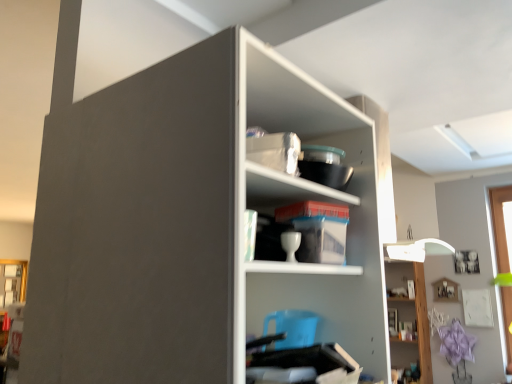
Question: In which direction should I rotate to look at white glossy cup at center, which is counted as the 2th shelf, starting from the right?

Choices:
 (A) left
 (B) right

Answer: (B)

Question: Would you say white matte shelf at center, positioned as the 1th shelf in front-to-back order, is a long distance from white glossy lamp at upper right, arranged as the 3th shelf when viewed from the front?

Choices:
 (A) no
 (B) yes

Answer: (B)

Question: From the image's perspective, is white matte shelf at center, which is counted as the 3th shelf, starting from the back, above white glossy lamp at upper right, which ranks as the first shelf in bottom-to-top order?

Choices:
 (A) no
 (B) yes

Answer: (B)

Question: Considering the relative positions of white matte shelf at center, the 2th shelf when ordered from top to bottom, and white glossy lamp at upper right, the first shelf positioned from the back, in the image provided, is white matte shelf at center, the 2th shelf when ordered from top to bottom, to the left of white glossy lamp at upper right, the first shelf positioned from the back, from the viewer's perspective?

Choices:
 (A) yes
 (B) no

Answer: (A)

Question: Does white matte shelf at center, the 2th shelf when ordered from top to bottom, touch white glossy lamp at upper right, positioned as the first shelf in right-to-left order?

Choices:
 (A) no
 (B) yes

Answer: (A)

Question: Does white matte shelf at center, which is counted as the 3th shelf, starting from the back, have a greater width compared to white glossy lamp at upper right, positioned as the first shelf in right-to-left order?

Choices:
 (A) no
 (B) yes

Answer: (B)

Question: Would you say white matte shelf at center, the first shelf when ordered from left to right, is outside white glossy lamp at upper right, arranged as the 3th shelf when viewed from the front?

Choices:
 (A) yes
 (B) no

Answer: (A)

Question: Considering the relative positions of matte gold frame at lower left and white glossy cup at center, acting as the 3th shelf starting from the bottom, in the image provided, is matte gold frame at lower left to the right of white glossy cup at center, acting as the 3th shelf starting from the bottom, from the viewer's perspective?

Choices:
 (A) yes
 (B) no

Answer: (B)

Question: Can you confirm if matte gold frame at lower left is thinner than white glossy cup at center, which is counted as the 2th shelf, starting from the left?

Choices:
 (A) yes
 (B) no

Answer: (A)

Question: Is white glossy cup at center, acting as the 3th shelf starting from the bottom, at the back of matte gold frame at lower left?

Choices:
 (A) no
 (B) yes

Answer: (A)

Question: Is matte gold frame at lower left outside of white glossy cup at center, which ranks as the second shelf in back-to-front order?

Choices:
 (A) yes
 (B) no

Answer: (A)

Question: Is matte gold frame at lower left bigger than white glossy cup at center, which is counted as the 2th shelf, starting from the left?

Choices:
 (A) no
 (B) yes

Answer: (B)

Question: Considering the relative sizes of matte gold frame at lower left and white glossy cup at center, which is the second shelf from front to back, in the image provided, is matte gold frame at lower left smaller than white glossy cup at center, which is the second shelf from front to back,?

Choices:
 (A) yes
 (B) no

Answer: (B)

Question: Is matte gold frame at lower left further to the viewer compared to white matte shelf at center, the first shelf when ordered from left to right?

Choices:
 (A) no
 (B) yes

Answer: (B)